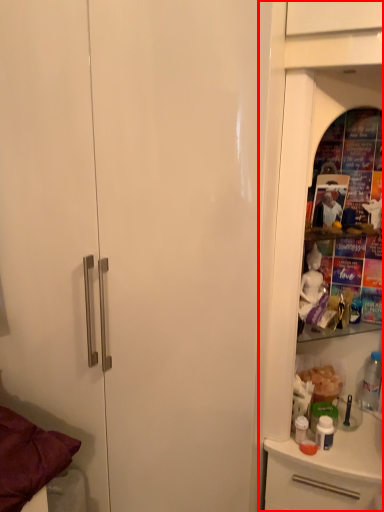
Question: From the image, what is the correct spatial relationship of dresser (annotated by the red box) in relation to bottle?

Choices:
 (A) right
 (B) left

Answer: (B)